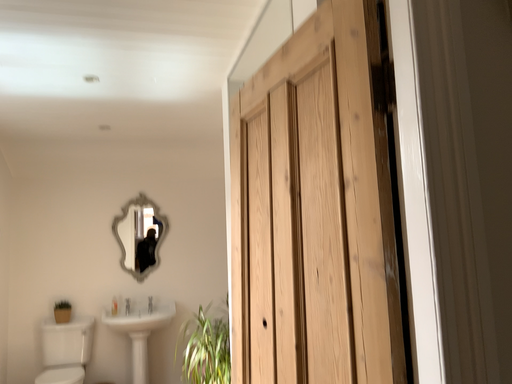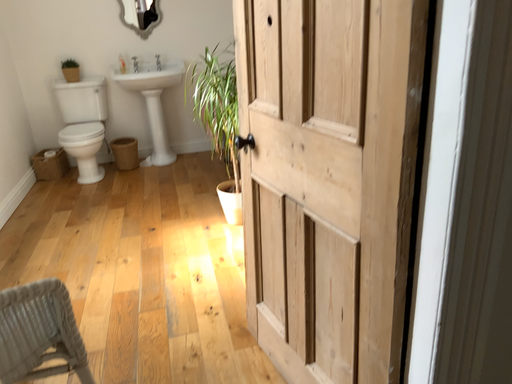
Question: Which way did the camera rotate in the video?

Choices:
 (A) rotated upward
 (B) rotated downward

Answer: (B)